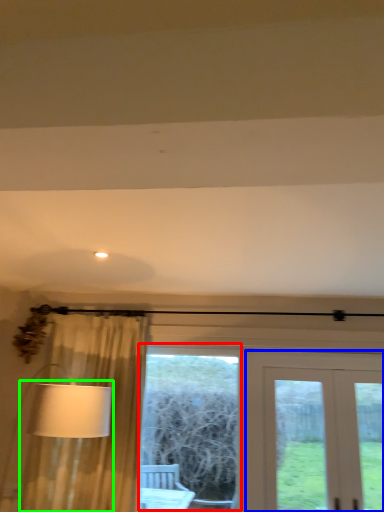
Question: Which is nearer to the bay window (highlighted by a red box)? door (highlighted by a blue box) or table lamp (highlighted by a green box).

Choices:
 (A) door
 (B) table lamp

Answer: (A)